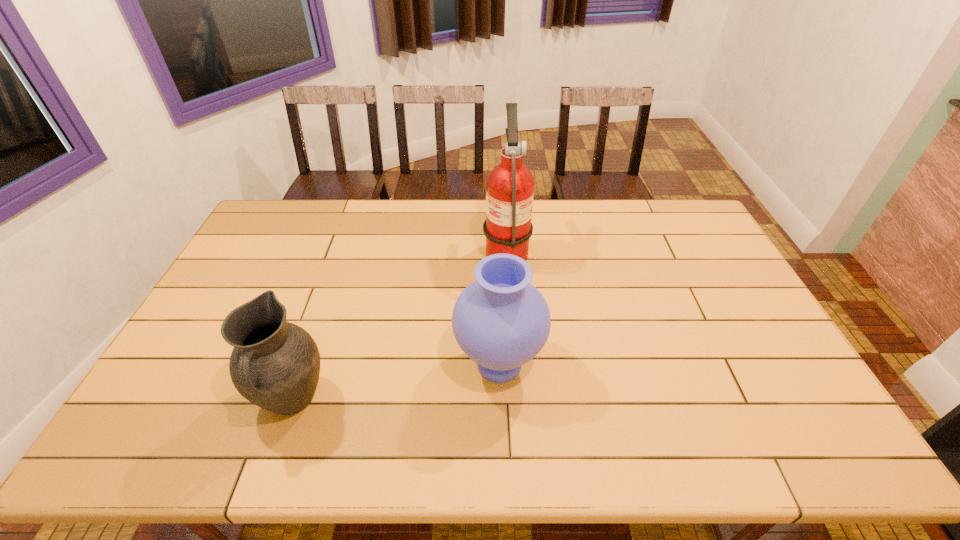
At what (x,y) coordinates should I click in order to perform the action: click on fire extinguisher. Please return your answer as a coordinate pair (x, y). This screenshot has height=540, width=960. Looking at the image, I should click on (510, 185).

I want to click on the farthest object, so click(510, 185).

Find the location of a particular element. The height and width of the screenshot is (540, 960). vase is located at coordinates (501, 321).

You are a GUI agent. You are given a task and a screenshot of the screen. Output one action in this format:
    pyautogui.click(x=<x>, y=<y>)
    Task: Click on the leftmost object
    This screenshot has height=540, width=960.
    Given the screenshot: What is the action you would take?
    pyautogui.click(x=275, y=364)

Find the location of `free point located on the nozzle and handle of the farthest object`. free point located on the nozzle and handle of the farthest object is located at coordinates (x=391, y=248).

Find the location of a particular element. The image size is (960, 540). vacant area situated on the nozzle and handle of the farthest object is located at coordinates click(x=402, y=248).

Find the location of `vacant area situated on the nozzle and handle of the farthest object`. vacant area situated on the nozzle and handle of the farthest object is located at coordinates (468, 248).

I want to click on vacant space located 0.370m on the back of the vase, so click(x=494, y=248).

Where is `object that is at the far edge`? object that is at the far edge is located at coordinates (510, 185).

You are a GUI agent. You are given a task and a screenshot of the screen. Output one action in this format:
    pyautogui.click(x=<x>, y=<y>)
    Task: Click on the object located at the near edge
    
    Given the screenshot: What is the action you would take?
    pyautogui.click(x=275, y=364)